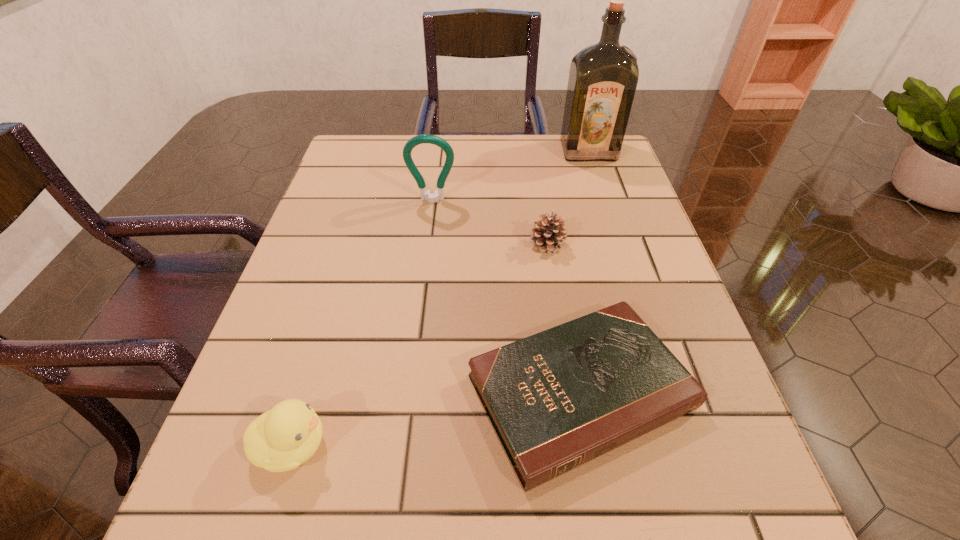
Find the location of a particular element. This screenshot has width=960, height=540. free space that satisfies the following two spatial constraints: 1. on the label of the tallest object; 2. at the beak of the duckling is located at coordinates (685, 446).

Locate an element on the screen. free space that satisfies the following two spatial constraints: 1. at the jaws of the second shortest object; 2. on the left side of the fourth object from right to left is located at coordinates (427, 245).

At what (x,y) coordinates should I click in order to perform the action: click on vacant space that satisfies the following two spatial constraints: 1. on the front side of the Bible; 2. at the beak of the duckling. Please return your answer as a coordinate pair (x, y). Looking at the image, I should click on (x=589, y=446).

Image resolution: width=960 pixels, height=540 pixels. I want to click on vacant area that satisfies the following two spatial constraints: 1. on the front side of the second shortest object; 2. at the beak of the leftmost object, so click(x=579, y=446).